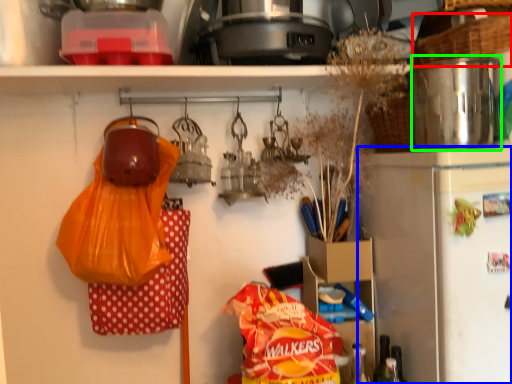
Question: Which object is positioned closest to basket (highlighted by a red box)? Select from refrigerator (highlighted by a blue box) and appliance (highlighted by a green box).

Choices:
 (A) refrigerator
 (B) appliance

Answer: (B)